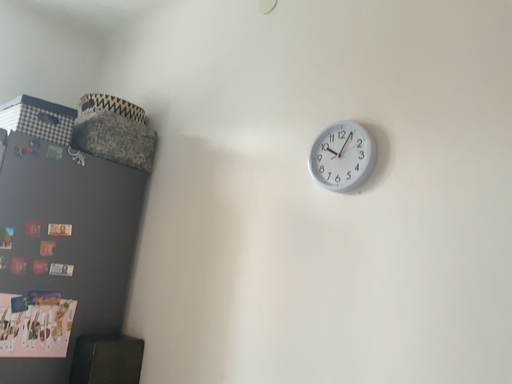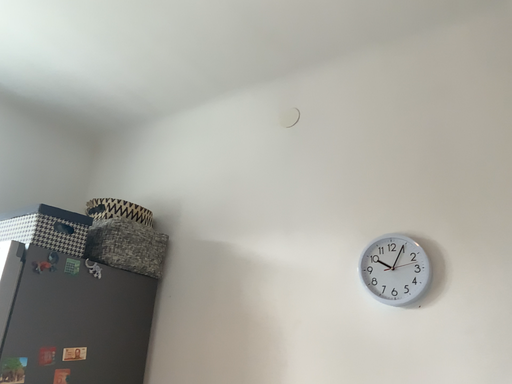
Question: How did the camera likely rotate when shooting the video?

Choices:
 (A) rotated right
 (B) rotated left

Answer: (A)